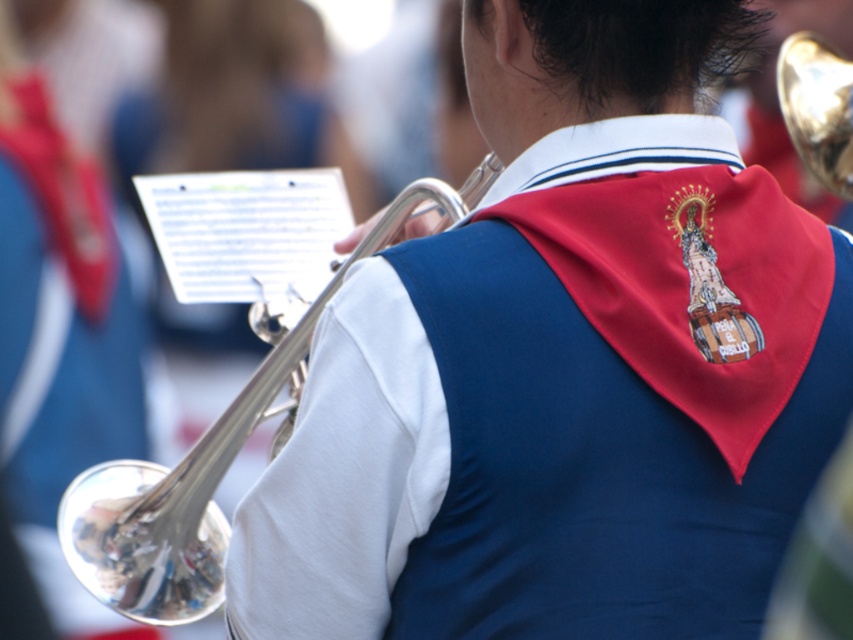
Question: Considering the real-world distances, which object is farthest from the metallic blue vest at center?

Choices:
 (A) shiny brass trumpet at upper right
 (B) silver polished trumpet at left

Answer: (A)

Question: Does metallic blue vest at center lie behind silver polished trumpet at left?

Choices:
 (A) yes
 (B) no

Answer: (B)

Question: Among these points, which one is nearest to the camera?

Choices:
 (A) (555, 161)
 (B) (781, 96)
 (C) (140, 595)

Answer: (A)

Question: Does metallic blue vest at center come in front of silver polished trumpet at left?

Choices:
 (A) no
 (B) yes

Answer: (B)

Question: Can you confirm if metallic blue vest at center is positioned to the left of silver polished trumpet at left?

Choices:
 (A) yes
 (B) no

Answer: (B)

Question: Which object is farther from the camera taking this photo?

Choices:
 (A) silver polished trumpet at left
 (B) metallic blue vest at center
 (C) shiny brass trumpet at upper right

Answer: (C)